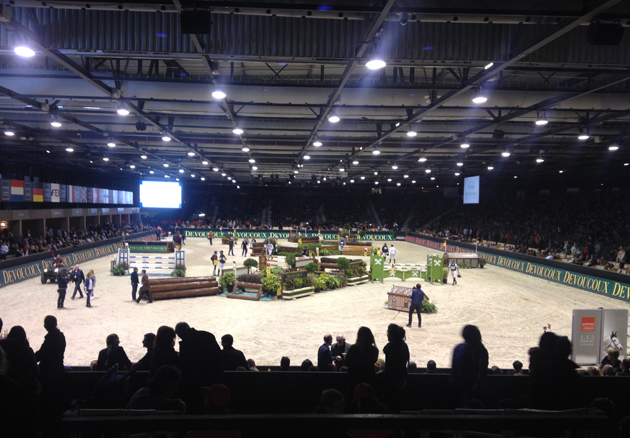
Find the location of a particular element. big screens is located at coordinates (155, 194), (467, 190).